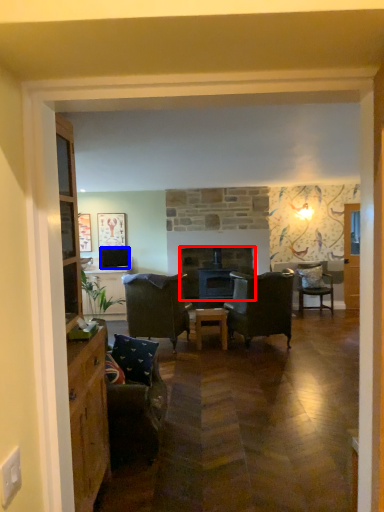
Question: Which object is further to the camera taking this photo, fireplace (highlighted by a red box) or television (highlighted by a blue box)?

Choices:
 (A) fireplace
 (B) television

Answer: (A)